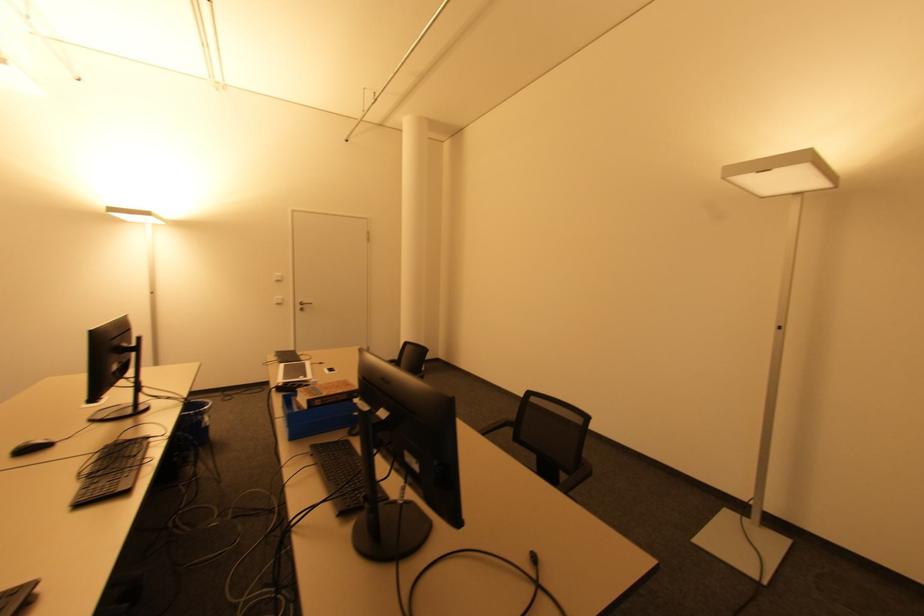
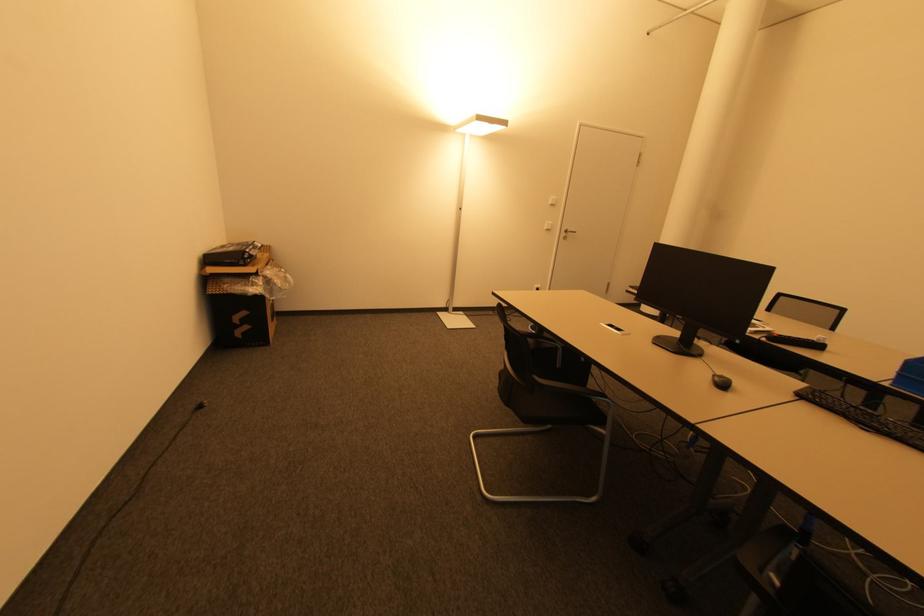
Where in the second image is the point corresponding to the point at 300,307 from the first image?

(565, 235)